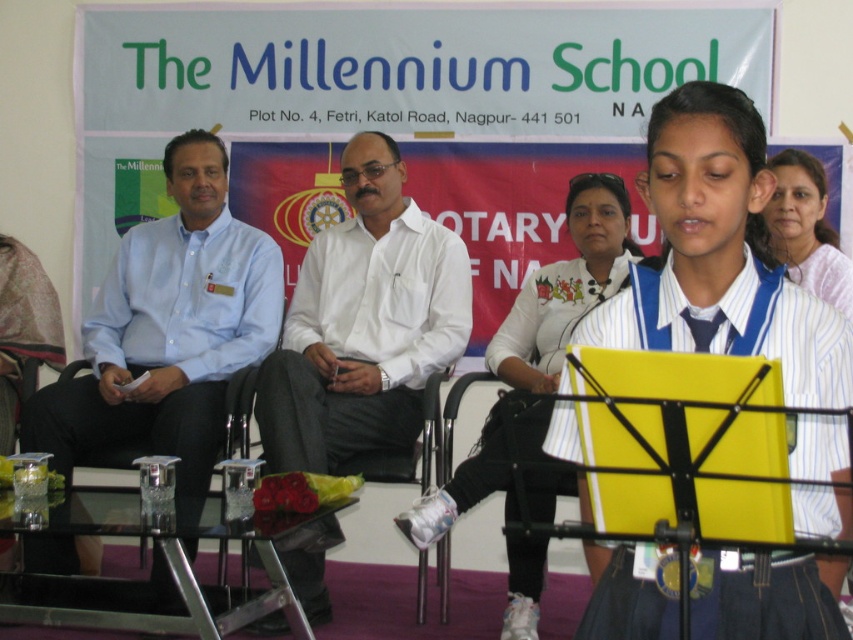
Looking at this image, who is more forward, (x=258, y=236) or (x=404, y=518)?

Point (x=404, y=518)

Find the location of a particular element. light blue shirt at left is located at coordinates (169, 330).

Can you confirm if white smooth shirt at center is smaller than white striped fabric at center?

Incorrect, white smooth shirt at center is not smaller in size than white striped fabric at center.

Which is more to the left, white smooth shirt at center or white striped fabric at center?

white smooth shirt at center

At what (x,y) coordinates should I click in order to perform the action: click on white smooth shirt at center. Please return your answer as a coordinate pair (x, y). This screenshot has height=640, width=853. Looking at the image, I should click on (364, 323).

Find the location of a particular element. This screenshot has height=640, width=853. white smooth shirt at center is located at coordinates (364, 323).

Can you confirm if white striped fabric at center is positioned below white striped shirt at center?

Indeed, white striped fabric at center is positioned under white striped shirt at center.

What do you see at coordinates (732, 324) in the screenshot? I see `white striped fabric at center` at bounding box center [732, 324].

Does point (732, 328) come in front of point (538, 268)?

Yes, point (732, 328) is closer to viewer.

The height and width of the screenshot is (640, 853). What are the coordinates of `white striped fabric at center` in the screenshot? It's located at (732, 324).